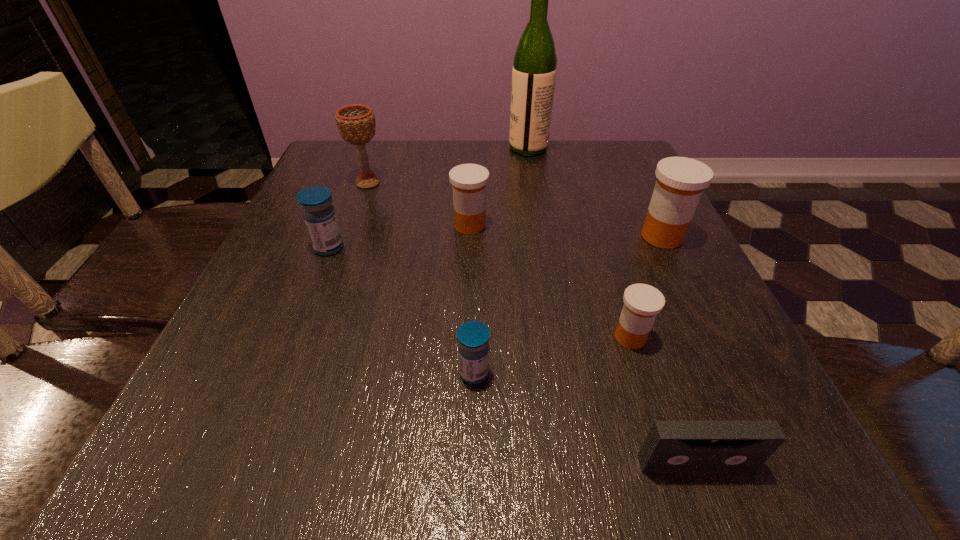
Locate an element on the screen. This screenshot has width=960, height=540. free point that satisfies the following two spatial constraints: 1. on the label of the second smallest orange medicine; 2. on the front side of the leftmost medicine is located at coordinates (469, 248).

This screenshot has width=960, height=540. Identify the location of blank area in the image that satisfies the following two spatial constraints: 1. on the label of the right blue medicine; 2. on the right side of the second biggest orange medicine. (466, 373).